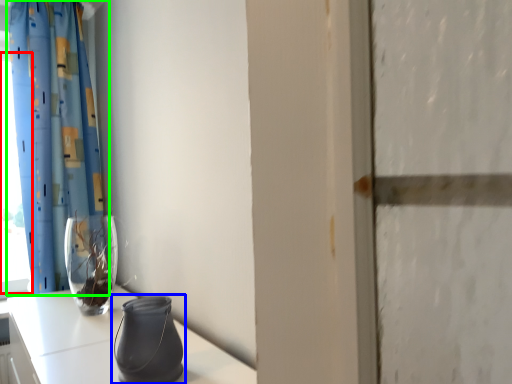
Question: Which is nearer to the window (highlighted by a red box)? vase (highlighted by a blue box) or curtain (highlighted by a green box).

Choices:
 (A) vase
 (B) curtain

Answer: (B)